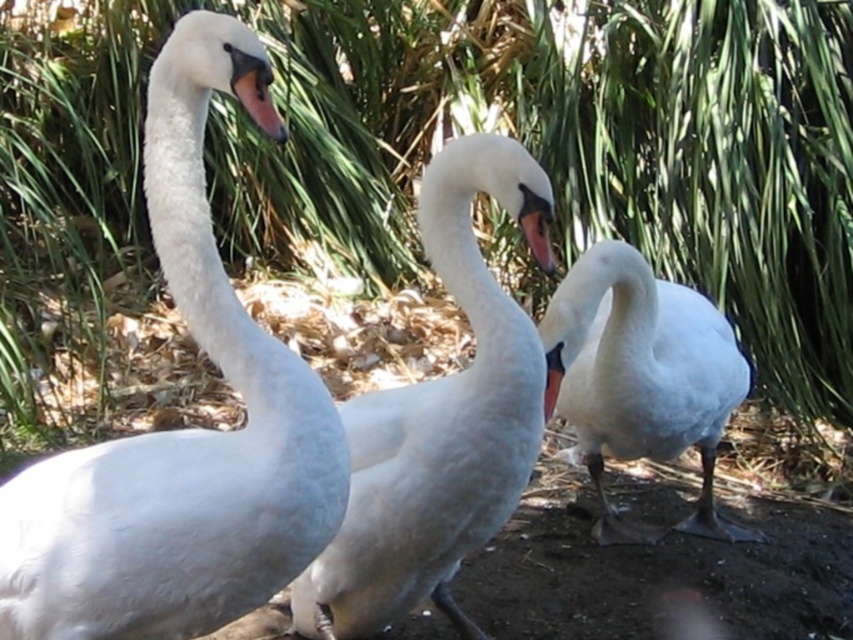
Question: Among these points, which one is nearest to the camera?

Choices:
 (A) (73, 618)
 (B) (543, 259)
 (C) (711, 362)
 (D) (543, 403)

Answer: (A)

Question: Can you confirm if white glossy swan at center is positioned to the right of matte pink beak at upper left?

Choices:
 (A) yes
 (B) no

Answer: (A)

Question: Is white matte swan at center smaller than matte pink beak at upper left?

Choices:
 (A) yes
 (B) no

Answer: (B)

Question: Does white matte swan at center appear over matte orange beak at center?

Choices:
 (A) yes
 (B) no

Answer: (B)

Question: Which point is closer to the camera taking this photo?

Choices:
 (A) (247, 109)
 (B) (534, 371)

Answer: (B)

Question: Which object is closer to the camera taking this photo?

Choices:
 (A) matte orange beak at center
 (B) pink glossy beak at center

Answer: (B)